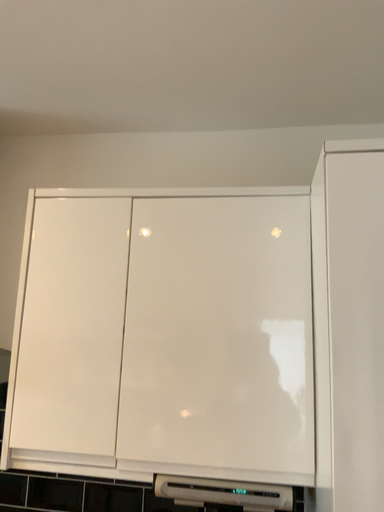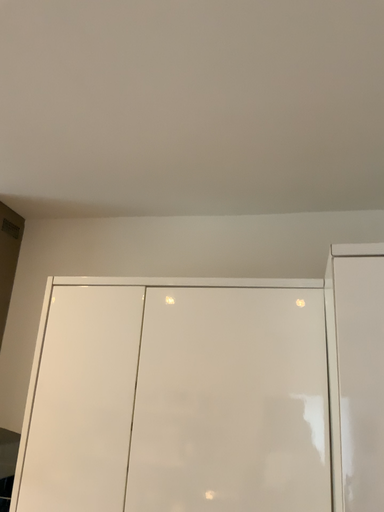
Question: Which way did the camera rotate in the video?

Choices:
 (A) rotated upward
 (B) rotated downward

Answer: (A)